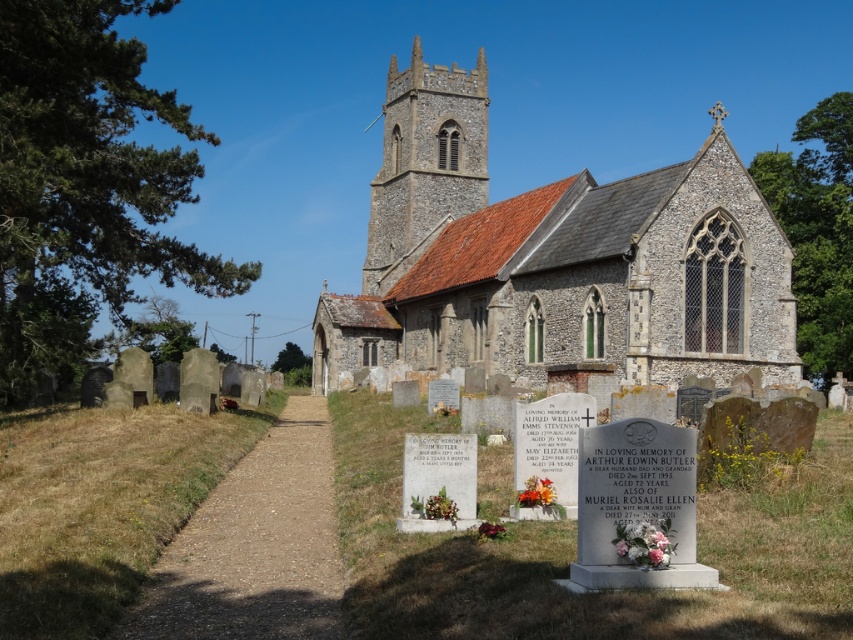
You are standing in front of the stone church at center and want to place a decorative wreath on the stone steeple at center. Given that the wreath requires a base width of 2 meters to be securely placed, can you determine if the steeple is wide enough based on their relative sizes?

The stone church at center might be wider than the stone steeple at center, but the exact width of the steeple is not provided. Without knowing the steeple width, it is impossible to confirm if it can support the wreath.

You are a tourist visiting the church and want to take a photo that captures both the stone church at center and the stone steeple at center. Which one should you focus on to ensure the taller structure is in the frame?

The stone church at center is taller than the stone steeple at center, so you should focus on the stone church at center to ensure the taller structure is in the frame.

You are standing in front of the stone church at center and want to take a photo of the stone steeple at center. Since both are in the same location, will the steeple be fully visible in the photo if you frame the church in the center?

The stone church at center is closer to the viewer than the stone steeple at center, so if you frame the church in the center, the steeple might be partially obscured or not fully visible because it is behind the church.